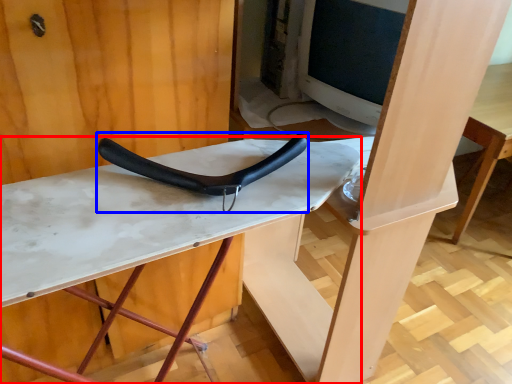
Question: Among these objects, which one is nearest to the camera, table (highlighted by a red box) or handle (highlighted by a blue box)?

Choices:
 (A) table
 (B) handle

Answer: (A)